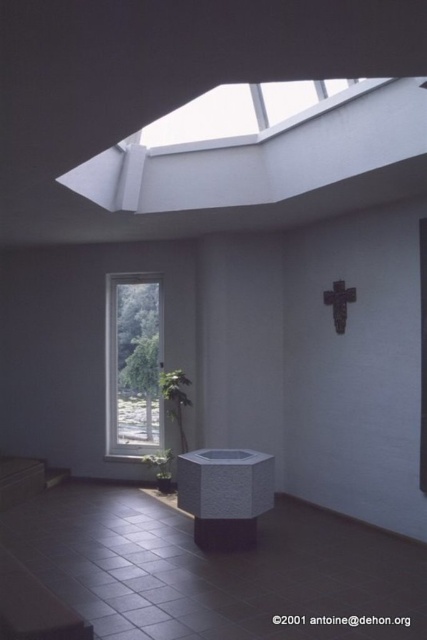
You are standing in the modern chapel and want to walk from the baptismal font to the altar. The baptismal font is located at point (154, 403) and the altar is at point (262, 129). Which point should you head towards first to reach the altar?

You should head towards point (262, 129) first because it is the location of the altar. However, according to the spatial description, point (154, 403) is closer to you than point (262, 129). Therefore, you need to move forward past the baptismal font at point (154, 403) to reach the altar at point (262, 129) which is further away.

You are a window installer assessing the church interior. You need to replace the clear glass window at center and the transparent glass skylight at upper center. Which of the two requires a taller replacement glass pane?

The clear glass window at center requires a taller replacement glass pane because it has a greater height compared to the transparent glass skylight at upper center.